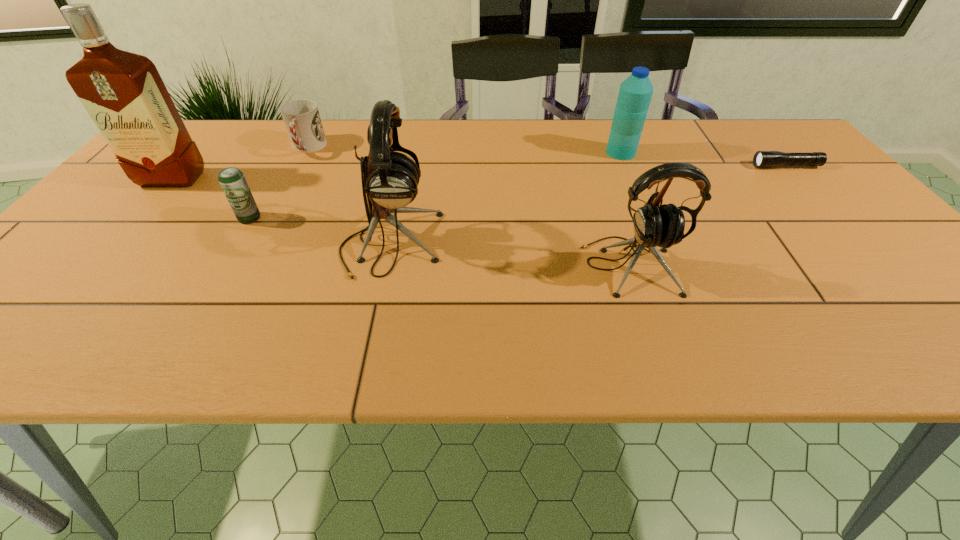
The height and width of the screenshot is (540, 960). I want to click on free space located on the back of the left earphone, so click(411, 151).

This screenshot has height=540, width=960. What are the coordinates of `free location located 0.320m on the right of the shorter earphone` in the screenshot? It's located at (828, 266).

The height and width of the screenshot is (540, 960). I want to click on free space located on the front of the water bottle, so click(633, 182).

Locate an element on the screen. This screenshot has height=540, width=960. vacant space positioned 0.300m on the front label of the tallest object is located at coordinates (89, 276).

Identify the location of vacant space located 0.110m on the side of the cup where the handle is located. The width and height of the screenshot is (960, 540). (289, 184).

In order to click on free region located at the lens end of the rightmost object in this screenshot , I will do `click(694, 166)`.

Locate an element on the screen. This screenshot has width=960, height=540. free location located 0.260m at the lens end of the rightmost object is located at coordinates (657, 166).

You are a GUI agent. You are given a task and a screenshot of the screen. Output one action in this format:
    pyautogui.click(x=<x>, y=<y>)
    Task: Click on the vacant area situated 0.260m at the lens end of the rightmost object
    Image resolution: width=960 pixels, height=540 pixels.
    Given the screenshot: What is the action you would take?
    pyautogui.click(x=657, y=166)

The image size is (960, 540). What are the coordinates of `free spot located on the front of the beer can` in the screenshot? It's located at (232, 249).

Where is `water bottle at the far edge`? water bottle at the far edge is located at coordinates (x=635, y=93).